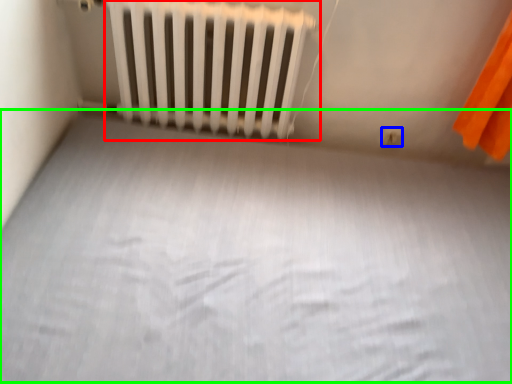
Question: Considering the real-world distances, which object is farthest from radiator (highlighted by a red box)? electric outlet (highlighted by a blue box) or bed frame (highlighted by a green box)?

Choices:
 (A) electric outlet
 (B) bed frame

Answer: (A)